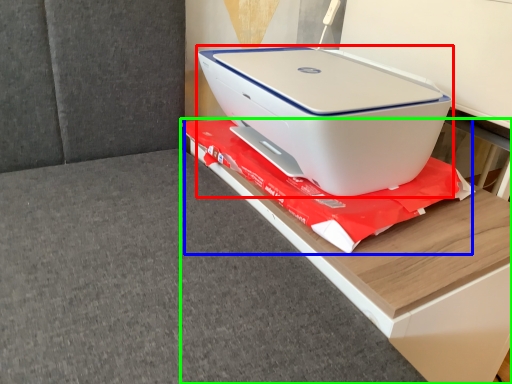
Question: Which is nearer to the printer (highlighted by a red box)? material (highlighted by a blue box) or furniture (highlighted by a green box).

Choices:
 (A) material
 (B) furniture

Answer: (A)